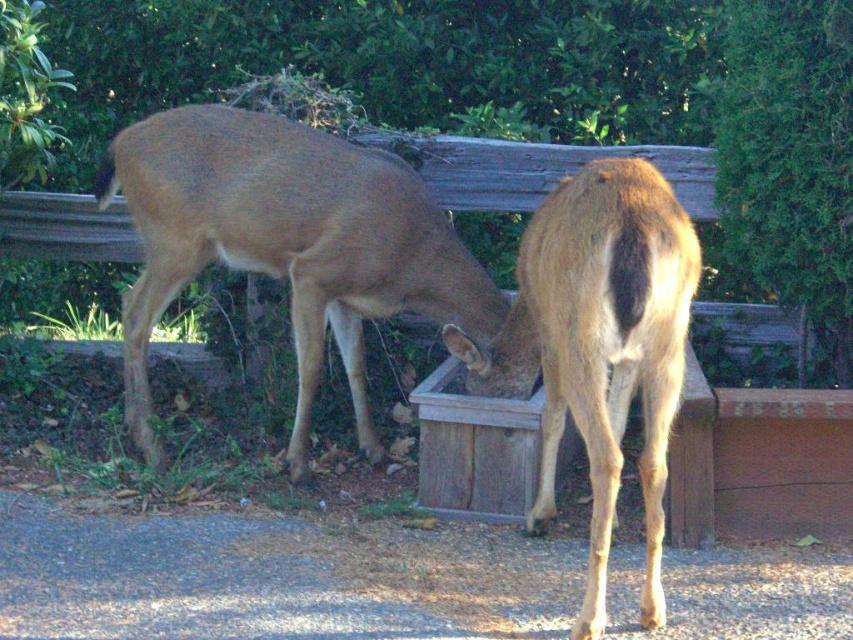
You are a wildlife photographer trying to capture both deer in a single shot. Since the brown matte deer at center is blocking the view of the brown fur deer at right, can you adjust your position to see both without moving the deer?

The brown matte deer at center is positioned over the brown fur deer at right, so moving your camera position slightly to the side might allow you to see both deer without obstruction.

You are a wildlife photographer aiming to capture both the brown matte deer at center and the brown fur deer at right in a single frame. Based on their positions, which deer is positioned closer to the camera?

The brown matte deer at center is positioned closer to the camera than the brown fur deer at right because it appears wider, indicating it is larger in the frame due to proximity.

You are a wildlife photographer aiming to capture a photo of both the brown matte deer at center and the brown fur deer at right. Since you want to ensure both deer are fully visible in the frame, which deer should you position closer to the camera to avoid being blocked by the wooden box?

You should position the brown matte deer at center closer to the camera because it is taller than the brown fur deer at right, so it might block the smaller deer if placed behind.